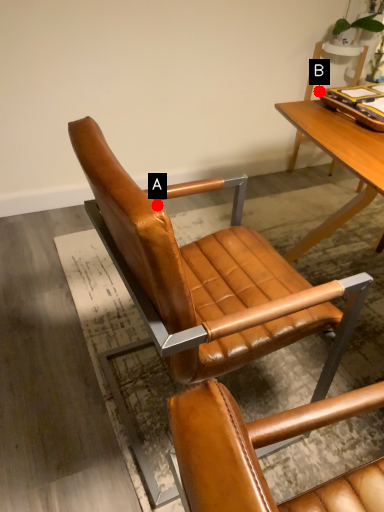
Question: Two points are circled on the image, labeled by A and B beside each circle. Which point appears closest to the camera in this image?

Choices:
 (A) A is closer
 (B) B is closer

Answer: (A)